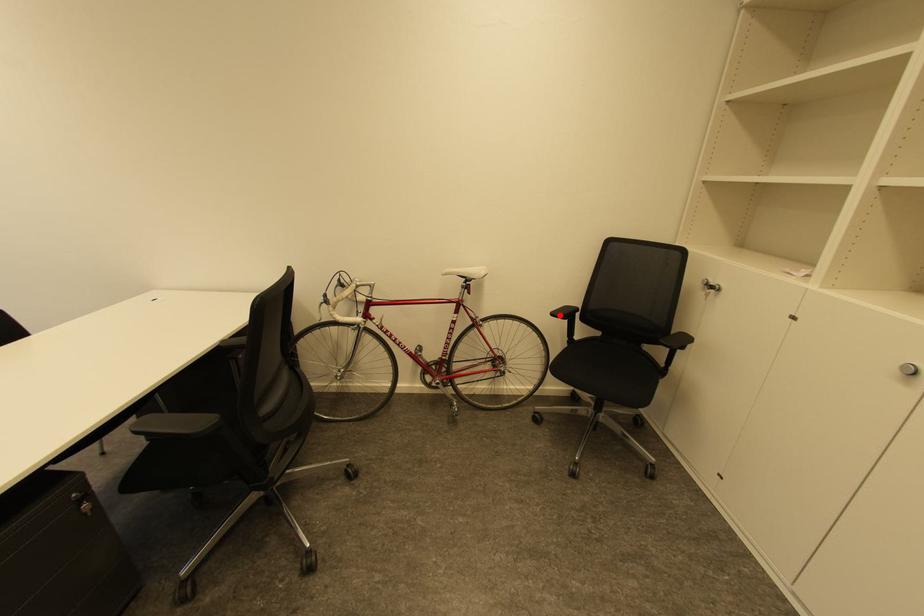
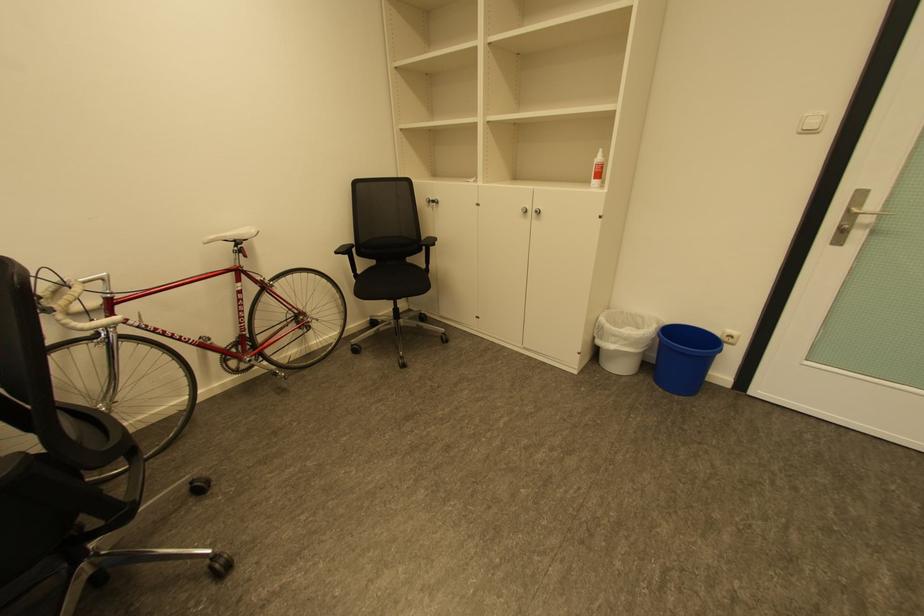
Locate, in the second image, the point that corresponds to the highlighted location in the first image.

(344, 253)